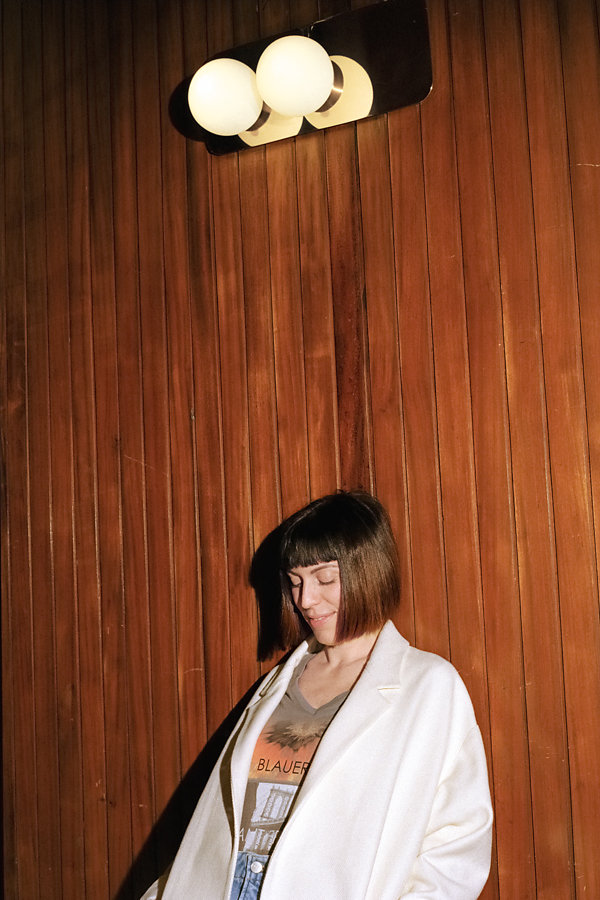
This screenshot has width=600, height=900. I want to click on left light bulb, so click(x=221, y=101).